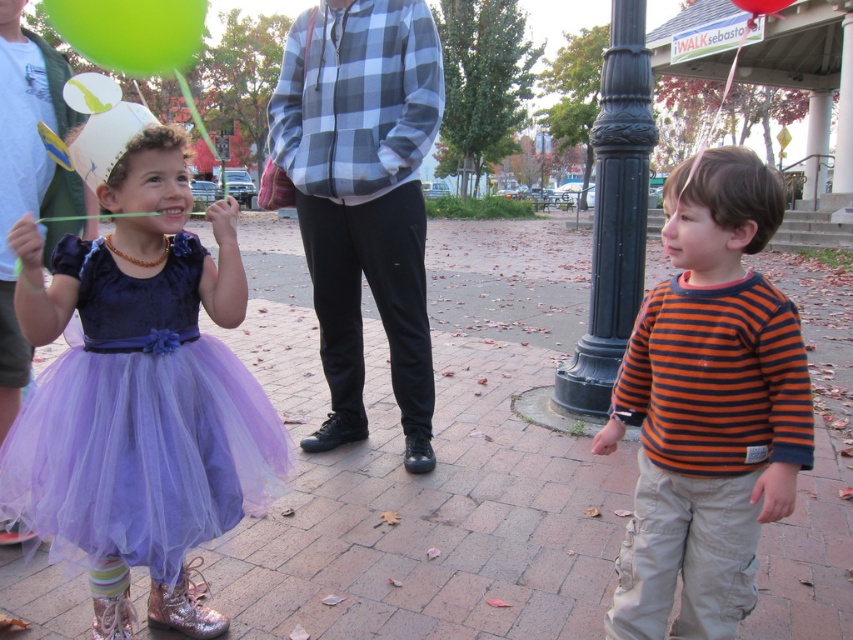
Does striped cotton shirt at center have a greater height compared to black cast iron pole at center?

Yes, striped cotton shirt at center is taller than black cast iron pole at center.

Is point (653, 337) positioned behind point (613, 220)?

That is False.

At what (x,y) coordinates should I click in order to perform the action: click on striped cotton shirt at center. Please return your answer as a coordinate pair (x, y). The height and width of the screenshot is (640, 853). Looking at the image, I should click on (708, 406).

In order to click on striped cotton shirt at center in this screenshot , I will do `click(708, 406)`.

Which is above, striped cotton shirt at center or matte green balloon at left?

matte green balloon at left

Does striped cotton shirt at center appear on the left side of matte green balloon at left?

In fact, striped cotton shirt at center is to the right of matte green balloon at left.

Does point (625, 621) lie behind point (25, 51)?

No.

At what (x,y) coordinates should I click in order to perform the action: click on striped cotton shirt at center. Please return your answer as a coordinate pair (x, y). This screenshot has height=640, width=853. Looking at the image, I should click on (708, 406).

Between point (602, 358) and point (19, 387), which one is positioned behind?

The point (602, 358) is more distant.

Between black cast iron pole at center and matte green balloon at left, which one appears on the left side from the viewer's perspective?

Positioned to the left is matte green balloon at left.

Image resolution: width=853 pixels, height=640 pixels. What do you see at coordinates (614, 214) in the screenshot?
I see `black cast iron pole at center` at bounding box center [614, 214].

You are a GUI agent. You are given a task and a screenshot of the screen. Output one action in this format:
    pyautogui.click(x=<x>, y=<y>)
    Task: Click on the black cast iron pole at center
    Image resolution: width=853 pixels, height=640 pixels.
    Given the screenshot: What is the action you would take?
    pyautogui.click(x=614, y=214)